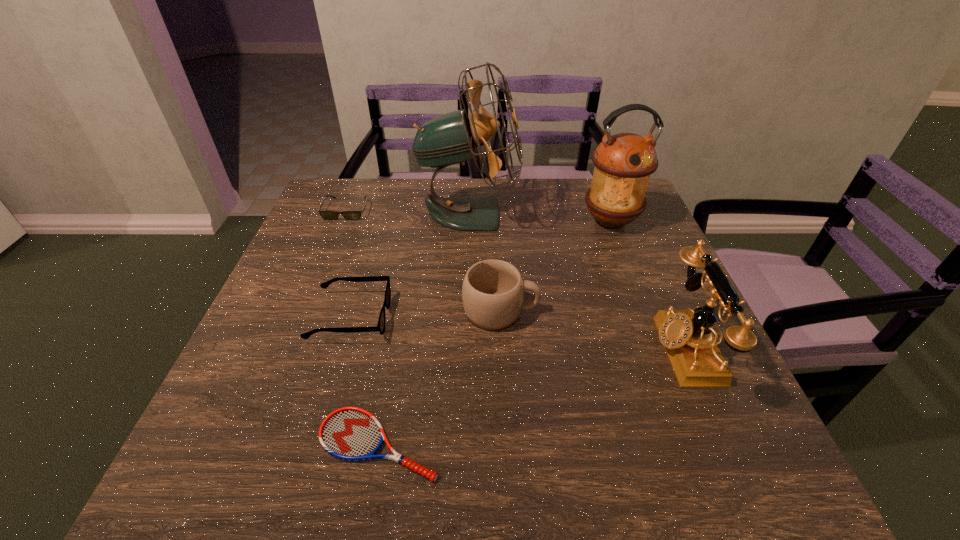
Identify the location of object at the near edge. (349, 433).

Find the location of `spectacles located in the left edge section of the desktop`. spectacles located in the left edge section of the desktop is located at coordinates coord(380,327).

Locate an element on the screen. This screenshot has width=960, height=540. sunglasses at the left edge is located at coordinates (327, 215).

Locate an element on the screen. Image resolution: width=960 pixels, height=540 pixels. oil lamp situated at the right edge is located at coordinates [624, 162].

At what (x,y) coordinates should I click in order to perform the action: click on telephone present at the right edge. Please return your answer as a coordinate pair (x, y). Looking at the image, I should click on (687, 336).

Where is `object at the far left corner`? object at the far left corner is located at coordinates (327, 215).

I want to click on object at the far right corner, so click(x=624, y=162).

I want to click on blank space at the far edge of the desktop, so click(x=579, y=203).

At what (x,y) coordinates should I click in order to perform the action: click on free location at the near edge of the desktop. Please return your answer as a coordinate pair (x, y). Looking at the image, I should click on (514, 443).

This screenshot has width=960, height=540. Find the location of `vacant area at the left edge`. vacant area at the left edge is located at coordinates (351, 256).